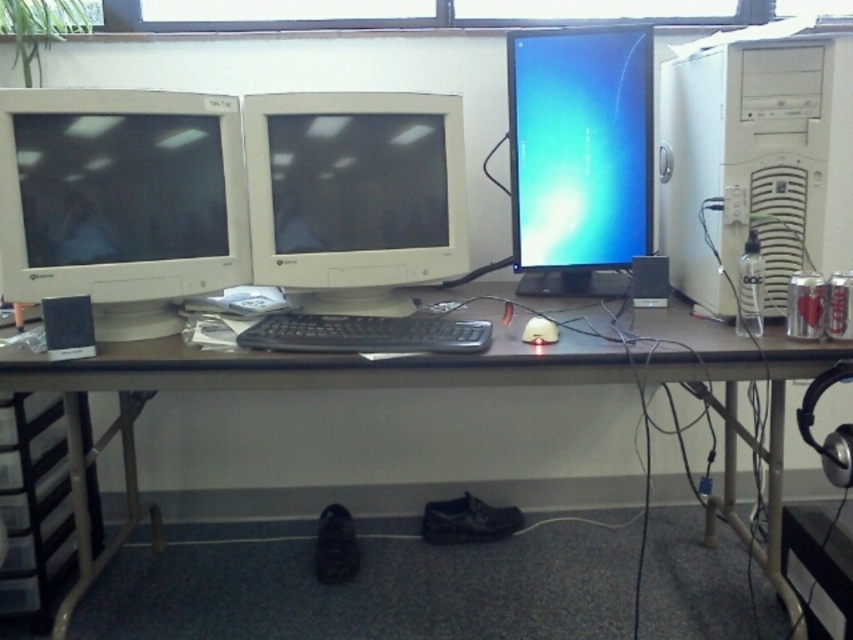
Question: Can you confirm if matte white monitor at center is thinner than white matte mouse at center?

Choices:
 (A) yes
 (B) no

Answer: (B)

Question: Is the position of brown wooden table at center less distant than that of black plastic keyboard at center?

Choices:
 (A) yes
 (B) no

Answer: (A)

Question: Which is farther from the matte white monitor at left?

Choices:
 (A) matte black monitor at center
 (B) white plastic tower at right
 (C) brown wooden table at center

Answer: (B)

Question: Is matte white monitor at left positioned behind black plastic keyboard at center?

Choices:
 (A) no
 (B) yes

Answer: (A)

Question: Which object is the farthest from the white matte mouse at center?

Choices:
 (A) black plastic keyboard at center
 (B) matte black monitor at center

Answer: (B)

Question: Which of the following is the farthest from the observer?

Choices:
 (A) (529, 342)
 (B) (247, 333)
 (C) (846, 198)

Answer: (C)